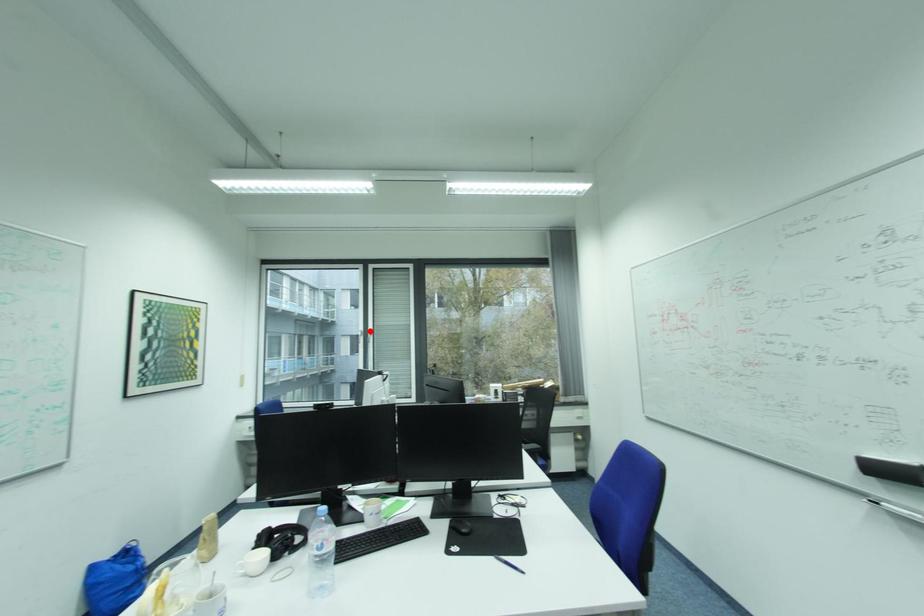
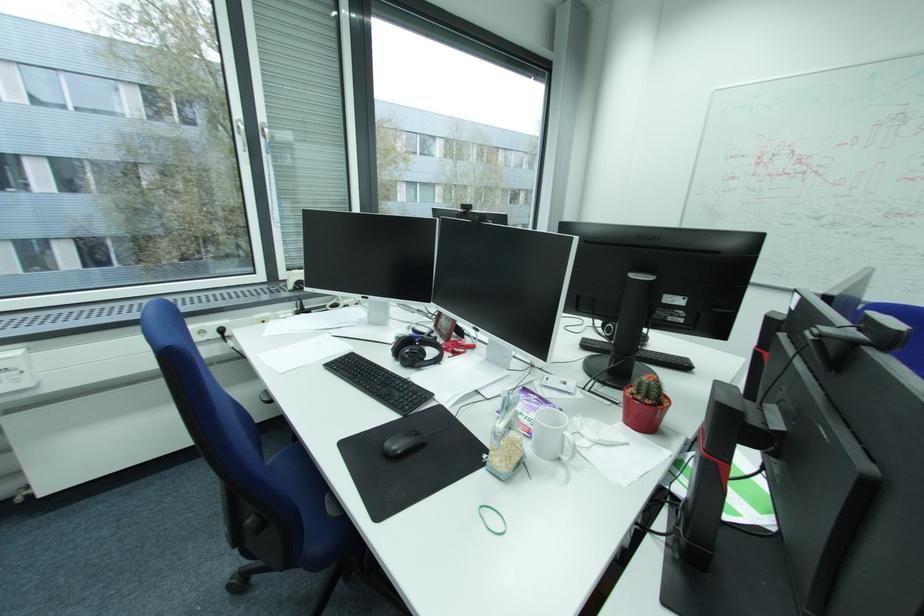
Question: A red point is marked in image1. In image2, is the corresponding 3D point closer to the camera or farther? Reply with the corresponding letter.

Choices:
 (A) The corresponding 3D point is closer.
 (B) The corresponding 3D point is farther.

Answer: (B)